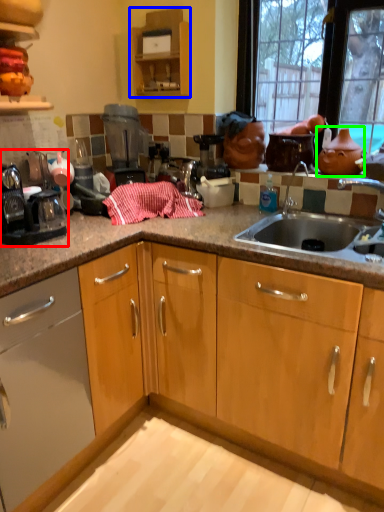
Question: Which object is the farthest from appliance (highlighted by a red box)? Choose among these: cabinetry (highlighted by a blue box) or tea pot (highlighted by a green box).

Choices:
 (A) cabinetry
 (B) tea pot

Answer: (B)